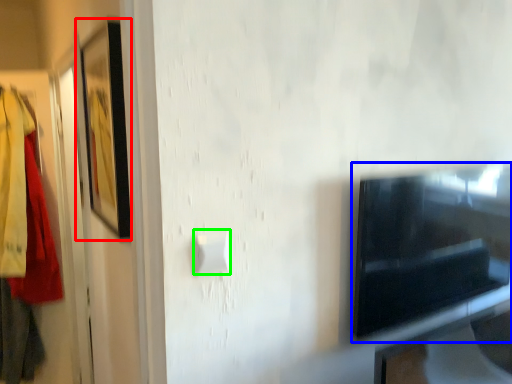
Question: Estimate the real-world distances between objects in this image. Which object is closer to picture frame (highlighted by a red box), appliance (highlighted by a blue box) or light switch (highlighted by a green box)?

Choices:
 (A) appliance
 (B) light switch

Answer: (B)